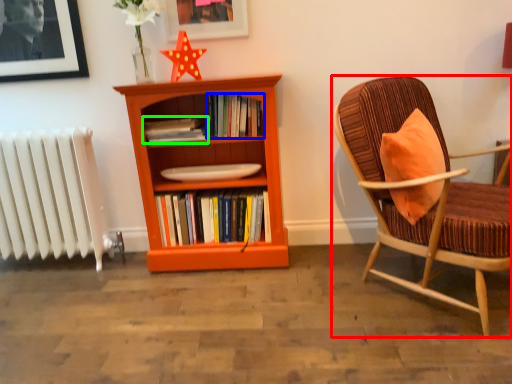
Question: Which is farther away from chair (highlighted by a red box)? book (highlighted by a blue box) or book (highlighted by a green box)?

Choices:
 (A) book
 (B) book

Answer: (B)